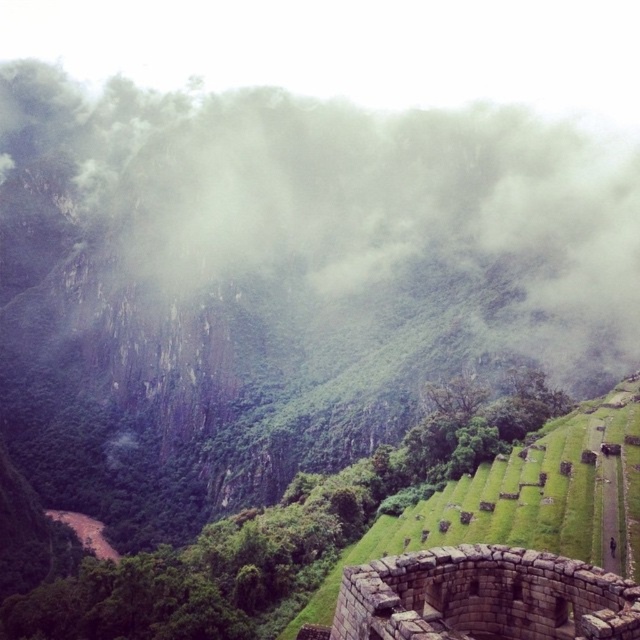
Is the position of foggy misty mountain at upper center more distant than that of stone wall at lower right?

Yes, it is.

Is foggy misty mountain at upper center above stone wall at lower right?

Yes.

Between point (240, 280) and point (564, 609), which one is positioned in front?

Point (564, 609) is more forward.

You are a GUI agent. You are given a task and a screenshot of the screen. Output one action in this format:
    pyautogui.click(x=<x>, y=<y>)
    Task: Click on the foggy misty mountain at upper center
    The height and width of the screenshot is (640, 640).
    Given the screenshot: What is the action you would take?
    pyautogui.click(x=339, y=212)